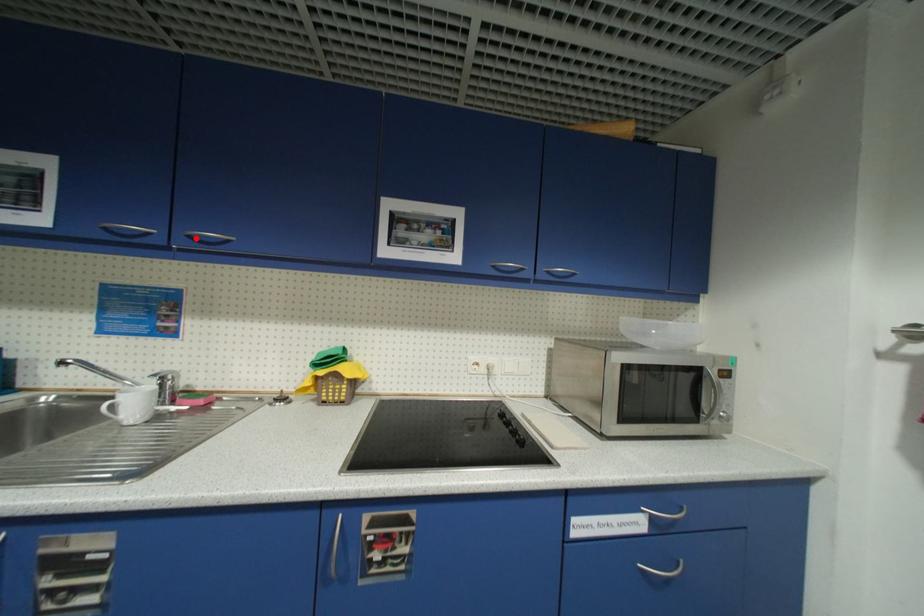
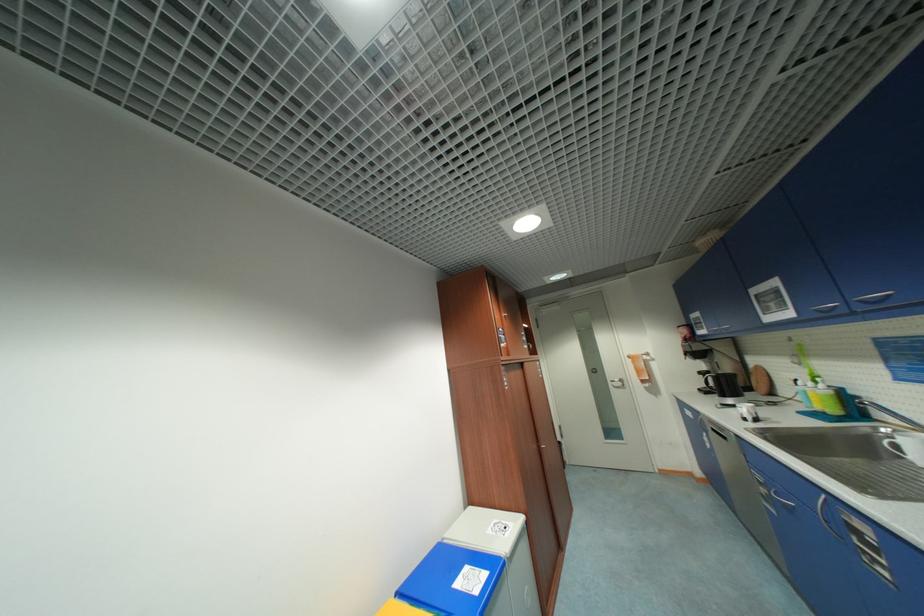
Find the pixel in the second image that matches the highlighted location in the first image.

(867, 302)